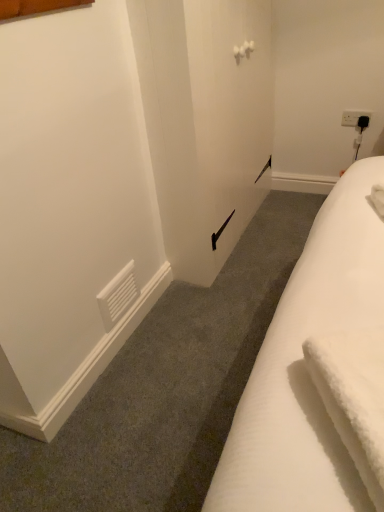
Question: Is white plastic electric outlet at upper right to the left of white fluffy bath towel at lower right from the viewer's perspective?

Choices:
 (A) yes
 (B) no

Answer: (B)

Question: From a real-world perspective, is white plastic electric outlet at upper right on top of white fluffy bath towel at lower right?

Choices:
 (A) no
 (B) yes

Answer: (A)

Question: From the image's perspective, does white plastic electric outlet at upper right appear higher than white fluffy bath towel at lower right?

Choices:
 (A) no
 (B) yes

Answer: (B)

Question: Is white plastic electric outlet at upper right wider than white fluffy bath towel at lower right?

Choices:
 (A) no
 (B) yes

Answer: (A)

Question: Would you say white plastic electric outlet at upper right is a long distance from white fluffy bath towel at lower right?

Choices:
 (A) yes
 (B) no

Answer: (A)

Question: Could you tell me if white plastic electric outlet at upper right is facing white fluffy bath towel at lower right?

Choices:
 (A) yes
 (B) no

Answer: (A)

Question: Are white fluffy bath towel at lower right and white plastic electric outlet at upper right making contact?

Choices:
 (A) no
 (B) yes

Answer: (A)

Question: Does white fluffy bath towel at lower right have a smaller size compared to white plastic electric outlet at upper right?

Choices:
 (A) no
 (B) yes

Answer: (A)

Question: Is white fluffy bath towel at lower right positioned before white plastic electric outlet at upper right?

Choices:
 (A) no
 (B) yes

Answer: (B)

Question: From a real-world perspective, is white fluffy bath towel at lower right physically above white plastic electric outlet at upper right?

Choices:
 (A) yes
 (B) no

Answer: (A)

Question: Considering the relative sizes of white fluffy bath towel at lower right and white plastic electric outlet at upper right in the image provided, is white fluffy bath towel at lower right thinner than white plastic electric outlet at upper right?

Choices:
 (A) no
 (B) yes

Answer: (A)

Question: Does white fluffy bath towel at lower right appear on the right side of white plastic electric outlet at upper right?

Choices:
 (A) no
 (B) yes

Answer: (A)

Question: Is white fluffy bath towel at lower right wider or thinner than white plastic electric outlet at upper right?

Choices:
 (A) wide
 (B) thin

Answer: (A)